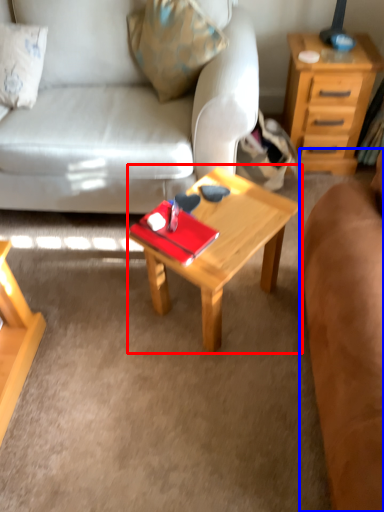
Question: Which point is closer to the camera, coffee table (highlighted by a red box) or studio couch (highlighted by a blue box)?

Choices:
 (A) coffee table
 (B) studio couch

Answer: (B)